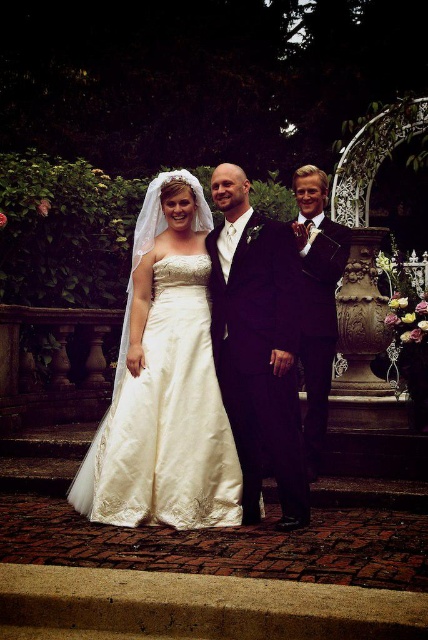
You are standing in the wedding scene and want to place a bouquet between the two points marked as point [225,173] and point [309,225]. Which point should you move toward to place the bouquet closer to the guests seated in the front row?

You should move toward point [225,173] because it is closer to the viewer than point [309,225], so placing the bouquet there would position it nearer to the front row guests.

You are a photographer at the wedding and need to position the two main subjects so that their outfits are clearly visible. Given the sizes of the satin dress at center and the satin suit at right, which outfit requires more space to accommodate its size?

The satin dress at center is larger in size than the satin suit at right, so it requires more space to accommodate its size.

You are a photographer at the wedding and want to capture a photo of the two central figures. The bride is in a white gown with a lace train, and the groom is in a satin black suit at center and a satin suit at right. Which groom is positioned lower in the frame?

The satin black suit at center is below the satin suit at right, so the groom in the satin black suit at center is positioned lower in the frame.